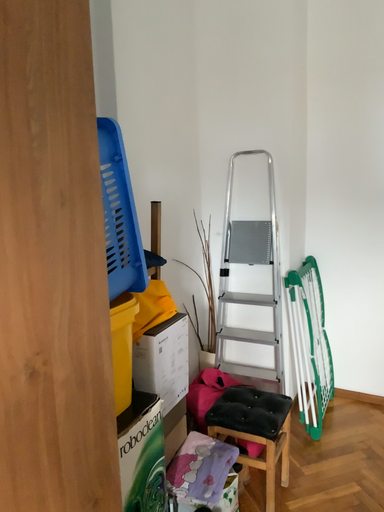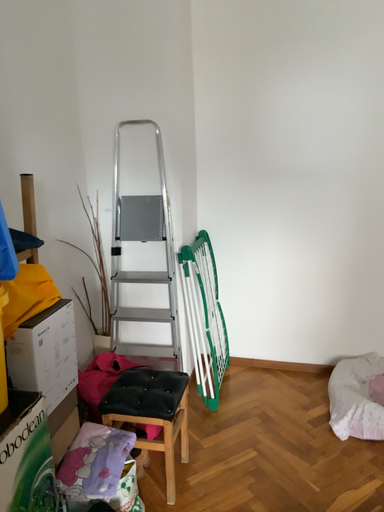
Question: How did the camera likely rotate when shooting the video?

Choices:
 (A) rotated left
 (B) rotated right

Answer: (B)